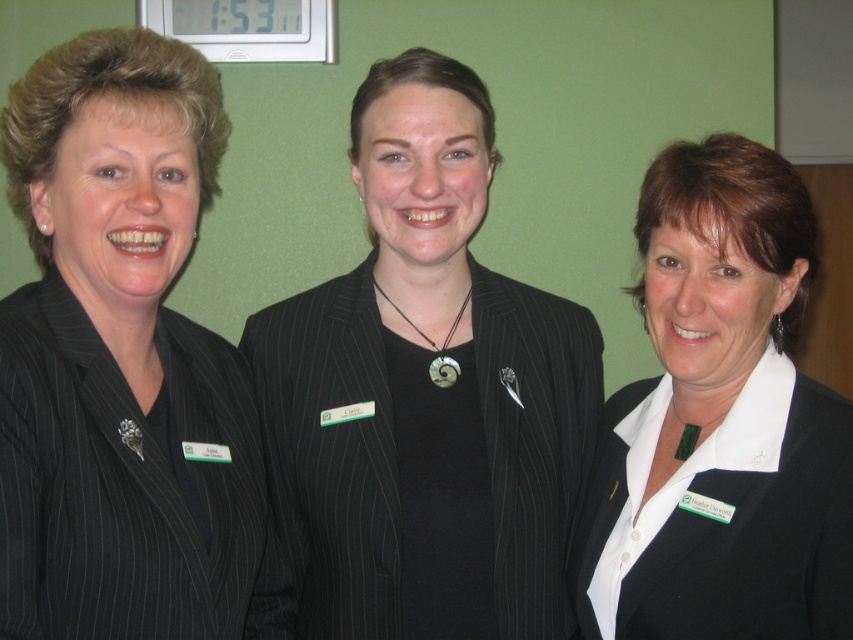
Can you confirm if white matte blazer at center is thinner than black pinstripe suit at center?

Indeed, white matte blazer at center has a lesser width compared to black pinstripe suit at center.

Who is more forward, (648,592) or (544,636)?

Point (648,592) is in front.

Which is behind, point (788, 394) or point (518, 429)?

The point (518, 429) is behind.

This screenshot has width=853, height=640. Identify the location of white matte blazer at center. (721, 422).

Looking at this image, which is more to the left, matte black suit at left or black pinstripe suit at center?

matte black suit at left is more to the left.

Is point (59, 97) closer to camera compared to point (344, 339)?

Yes, point (59, 97) is closer to viewer.

Where is `matte black suit at left`? The width and height of the screenshot is (853, 640). matte black suit at left is located at coordinates (122, 364).

Is point (218, 392) behind point (700, 524)?

Yes.

Does point (32, 406) come closer to viewer compared to point (662, 288)?

Yes, point (32, 406) is in front of point (662, 288).

Find the location of a particular element. The height and width of the screenshot is (640, 853). matte black suit at left is located at coordinates (122, 364).

The image size is (853, 640). What are the coordinates of `matte black suit at left` in the screenshot? It's located at (122, 364).